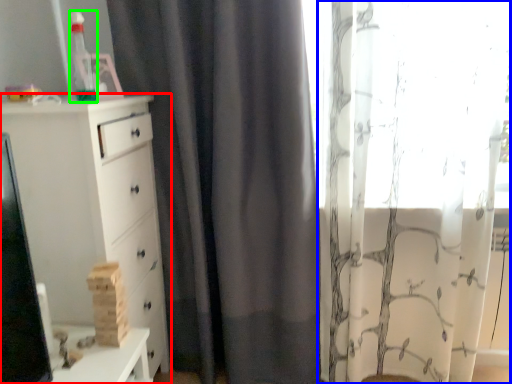
Question: Which is farther away from chest of drawers (highlighted by a red box)? curtain (highlighted by a blue box) or toy (highlighted by a green box)?

Choices:
 (A) curtain
 (B) toy

Answer: (A)